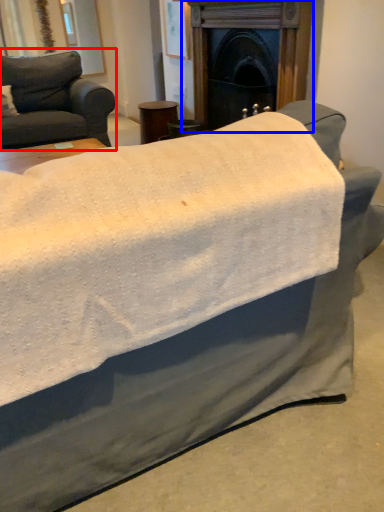
Question: Among these objects, which one is farthest to the camera, studio couch (highlighted by a red box) or fireplace (highlighted by a blue box)?

Choices:
 (A) studio couch
 (B) fireplace

Answer: (A)